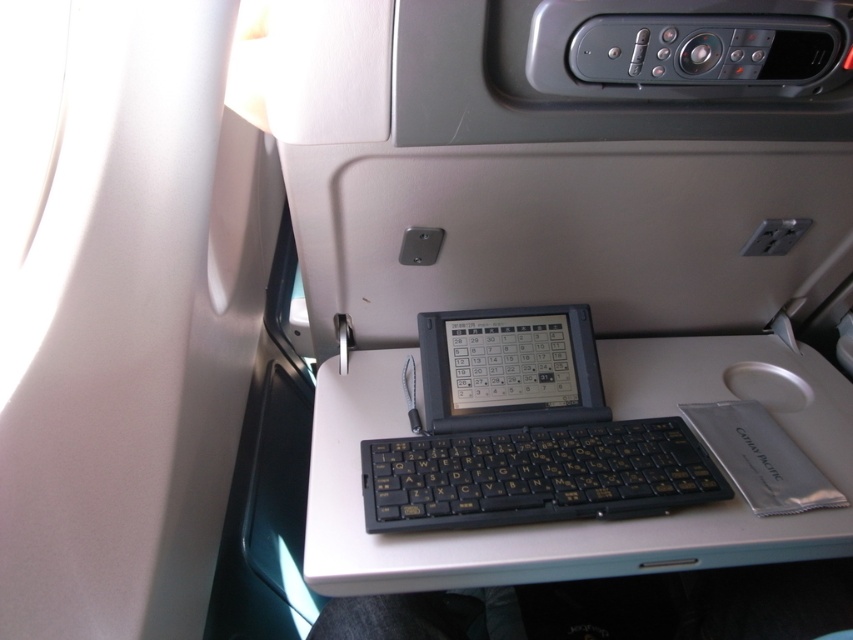
You are seated in an airplane seat and need to place a small notebook between the white plastic table at center and the silver metallic mouse at center. Based on their positions, where should you place the notebook?

The white plastic table at center is to the left of the silver metallic mouse at center, so you should place the notebook to the right of the white plastic table at center but before reaching the silver metallic mouse at center.

You are a passenger on an airplane and need to place a 10 cm tall travel mug on the tray table. The tray table is already holding a white plastic table at center and a silver metallic mouse at center. Based on their heights, will the travel mug fit on the tray table without falling off?

The white plastic table at center is much taller as silver metallic mouse at center, so the travel mug will likely fit on the tray table as there is enough vertical space between the objects and the table surface.

You are a flight attendant checking the tray table area. You need to ensure that the white plastic table at center and the black plastic keyboard at center are positioned safely for passengers. Based on their heights, which object is more likely to cause discomfort if a passenger leans forward?

The white plastic table at center is much taller than the black plastic keyboard at center, so it is more likely to cause discomfort if a passenger leans forward because of its greater height.